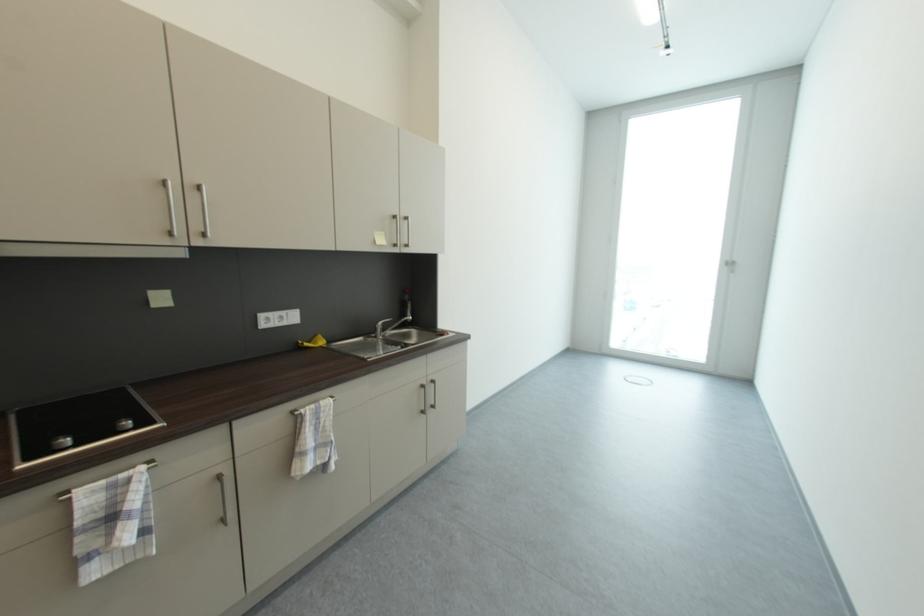
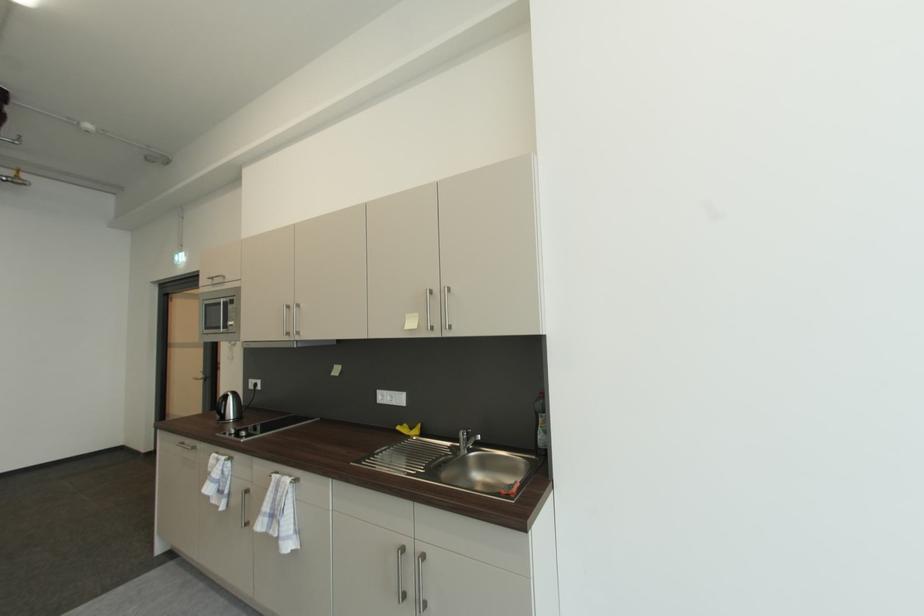
In the second image, find the point that corresponds to point 383,328 in the first image.

(465, 435)